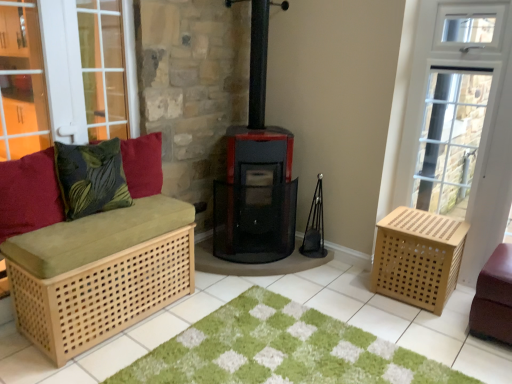
Question: Which is correct: natural wood bench at left, which ranks as the first furniture in left-to-right order, is inside natural wood crate at right, or outside of it?

Choices:
 (A) outside
 (B) inside

Answer: (A)

Question: In terms of width, does natural wood bench at left, the 2th furniture when ordered from right to left, look wider or thinner when compared to natural wood crate at right?

Choices:
 (A) thin
 (B) wide

Answer: (A)

Question: Which object is positioned closest to the leather ottoman at lower right, the 1th furniture when ordered from right to left?

Choices:
 (A) velvet red cushion at left, which is counted as the 1th pillow, starting from the left
 (B) velvety green pillow at left, marked as the 1th pillow in a right-to-left arrangement
 (C) natural wood crate at right
 (D) green leafy fabric pillow at left, placed as the 2th pillow when sorted from right to left
 (E) natural wood bench at left, which ranks as the first furniture in left-to-right order

Answer: (C)

Question: Estimate the real-world distances between objects in this image. Which object is closer to the leather ottoman at lower right, the 1th furniture when ordered from right to left?

Choices:
 (A) wooden crate at right
 (B) natural wood crate at right
 (C) green shaggy rug at center
 (D) velvety green pillow at left, the third pillow from the left
 (E) green leafy fabric pillow at left, placed as the 2th pillow when sorted from right to left

Answer: (B)